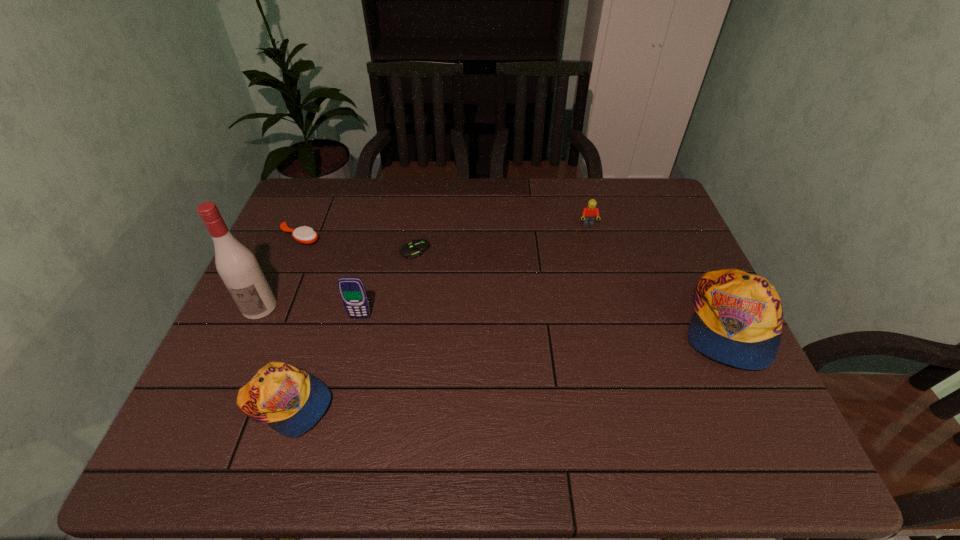
The height and width of the screenshot is (540, 960). Identify the location of object present at the right edge. (738, 320).

Locate an element on the screen. Image resolution: width=960 pixels, height=540 pixels. object that is at the near left corner is located at coordinates (290, 400).

In the image, there is a desktop. In order to click on vacant space at the far edge in this screenshot , I will do `click(451, 202)`.

At what (x,y) coordinates should I click in order to perform the action: click on vacant space at the near edge of the desktop. Please return your answer as a coordinate pair (x, y). Looking at the image, I should click on (435, 383).

Locate an element on the screen. The width and height of the screenshot is (960, 540). vacant space at the left edge of the desktop is located at coordinates (290, 281).

Locate an element on the screen. The height and width of the screenshot is (540, 960). vacant space at the right edge of the desktop is located at coordinates (636, 236).

This screenshot has width=960, height=540. In order to click on blank area at the far left corner in this screenshot , I will do `click(292, 204)`.

At what (x,y) coordinates should I click in order to perform the action: click on vacant position at the near left corner of the desktop. Please return your answer as a coordinate pair (x, y). Looking at the image, I should click on (240, 384).

The width and height of the screenshot is (960, 540). In the image, there is a desktop. What are the coordinates of `free space at the far right corner` in the screenshot? It's located at (611, 178).

You are a GUI agent. You are given a task and a screenshot of the screen. Output one action in this format:
    pyautogui.click(x=<x>, y=<y>)
    Task: Click on the free space between the second shortest object and the alcohol
    Image resolution: width=960 pixels, height=540 pixels.
    Given the screenshot: What is the action you would take?
    pyautogui.click(x=280, y=272)